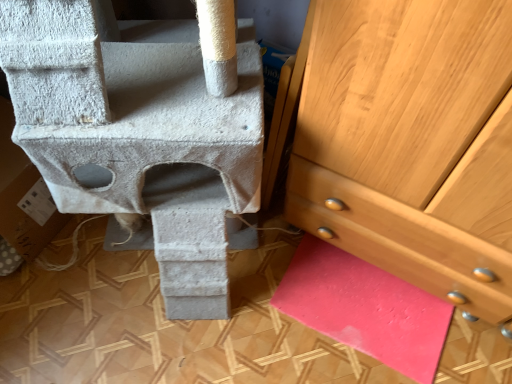
I want to click on free spot above pink felt bath mat at lower right (from a real-world perspective), so click(x=367, y=304).